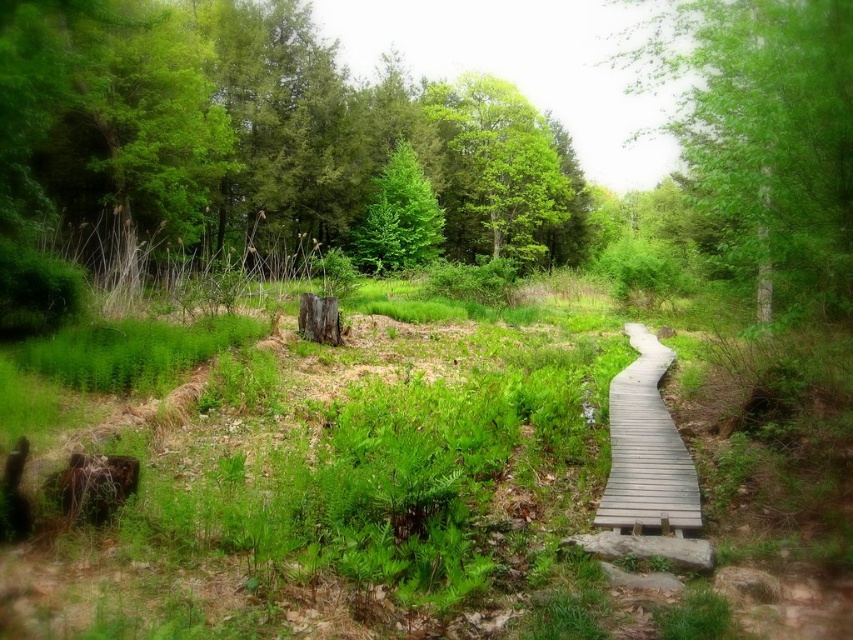
Question: Which is nearer to the gray wooden boardwalk at center-right?

Choices:
 (A) green leafy tree at upper right
 (B) green matte tree at center
 (C) green leafy tree at upper center

Answer: (A)

Question: Estimate the real-world distances between objects in this image. Which object is closer to the green grass at center?

Choices:
 (A) green leafy tree at upper right
 (B) gray wooden boardwalk at center-right

Answer: (B)

Question: Does green grass at center appear over green matte tree at center?

Choices:
 (A) yes
 (B) no

Answer: (B)

Question: Which point is closer to the camera?

Choices:
 (A) (782, 170)
 (B) (474, 196)
 (C) (650, 474)
 (D) (735, 545)

Answer: (D)

Question: Does green grass at center have a larger size compared to green leafy tree at upper center?

Choices:
 (A) yes
 (B) no

Answer: (B)

Question: In this image, where is green leafy tree at upper center located relative to green matte tree at center?

Choices:
 (A) right
 (B) left

Answer: (A)